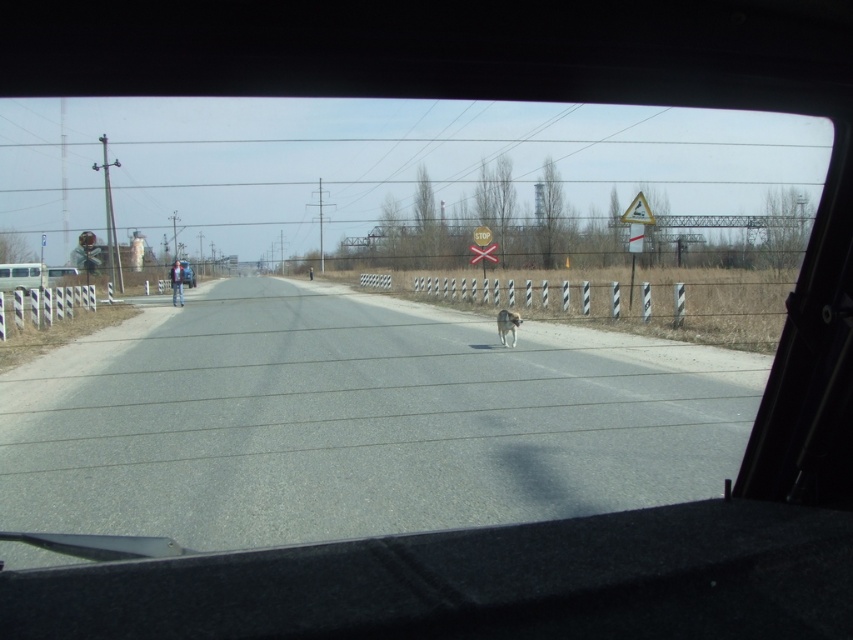
Is black rubber dashboard at lower center to the left of white fur dog at center from the viewer's perspective?

Correct, you'll find black rubber dashboard at lower center to the left of white fur dog at center.

Which is below, black rubber dashboard at lower center or white fur dog at center?

black rubber dashboard at lower center

This screenshot has width=853, height=640. Find the location of `black rubber dashboard at lower center`. black rubber dashboard at lower center is located at coordinates point(479,582).

What are the coordinates of `black rubber dashboard at lower center` in the screenshot? It's located at (479, 582).

Is white matte van at left to the left of white fur dog at center from the viewer's perspective?

Correct, you'll find white matte van at left to the left of white fur dog at center.

Is point (30, 280) positioned behind point (497, 314)?

Yes.

Is point (27, 276) positioned before point (519, 316)?

That is False.

Find the location of a particular element. The width and height of the screenshot is (853, 640). white matte van at left is located at coordinates (30, 275).

Based on the photo, can you confirm if transparent glass windshield at center is bigger than white fur dog at center?

Correct, transparent glass windshield at center is larger in size than white fur dog at center.

Who is positioned more to the left, transparent glass windshield at center or white fur dog at center?

white fur dog at center is more to the left.

Measure the distance between point (318, 221) and camera.

Point (318, 221) is 100.28 meters away from camera.

Identify the location of transparent glass windshield at center. The height and width of the screenshot is (640, 853). (399, 314).